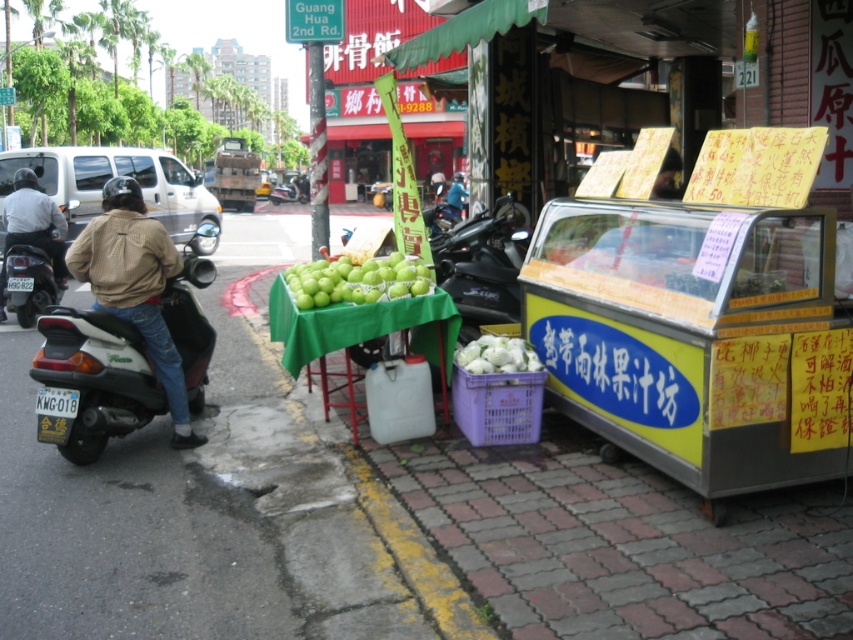
You are standing at the center of the image and want to locate the matte black scooter at left. Which direction should you look to find it?

You should look to the left to find the matte black scooter at left since it is positioned at the left side of the image.

You are a customer at the juice stand and want to grab your green matte apples at center and brown leather jacket at center. Which item is positioned lower?

The green matte apples at center are located below the brown leather jacket at center, so the green matte apples at center is the lower item.